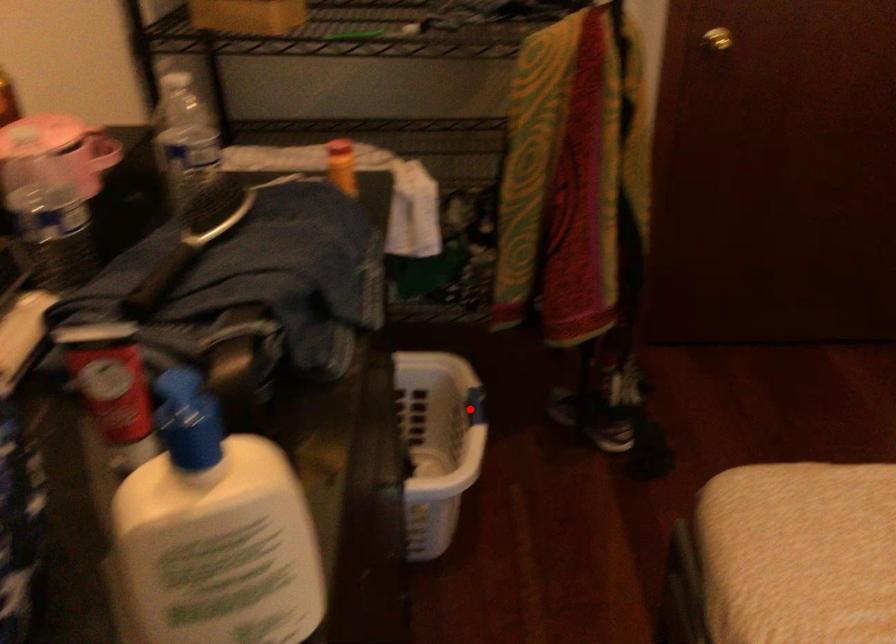
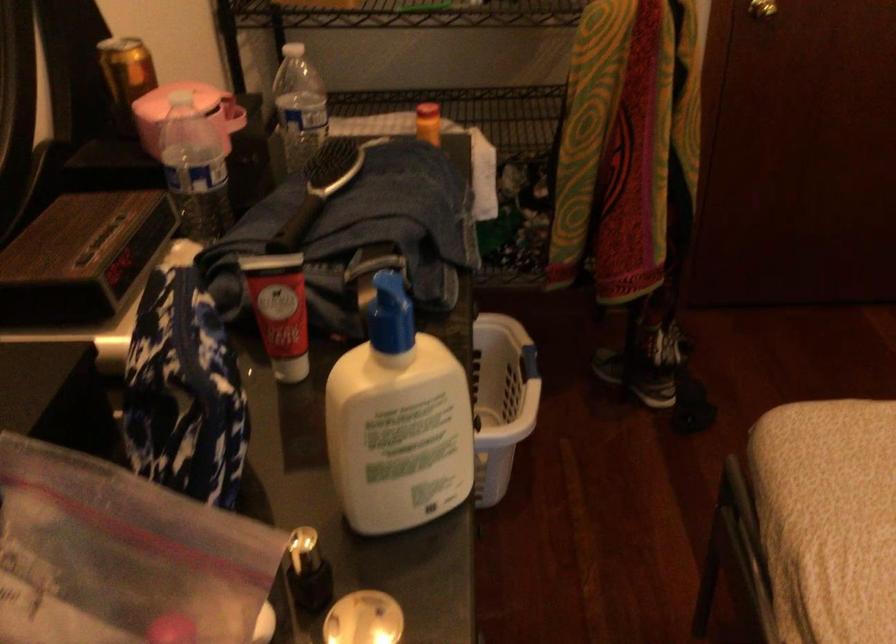
The point at the highlighted location is marked in the first image. Where is the corresponding point in the second image?

(529, 363)